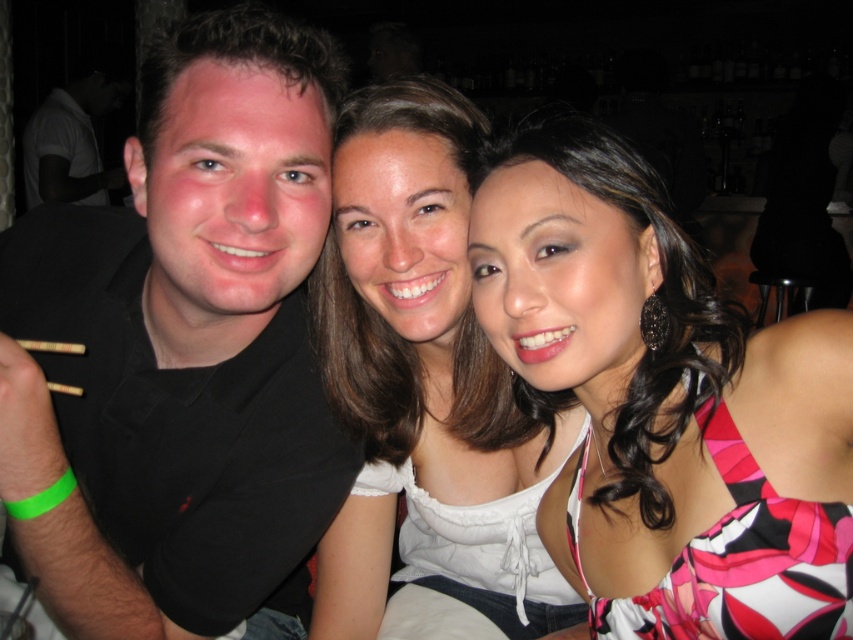
Question: Does black shirt at left appear on the left side of white satin blouse at center?

Choices:
 (A) no
 (B) yes

Answer: (B)

Question: Which of the following is the closest to the observer?

Choices:
 (A) (844, 492)
 (B) (213, 86)
 (C) (426, 272)

Answer: (A)

Question: Which point appears farthest from the camera in this image?

Choices:
 (A) (141, 280)
 (B) (71, 189)
 (C) (471, 218)

Answer: (B)

Question: Which point is farther to the camera?

Choices:
 (A) printed fabric dress at center
 (B) white satin blouse at center
 (C) white matte shirt at left
 (D) black shirt at left

Answer: (C)

Question: Is printed fabric dress at center smaller than white matte shirt at left?

Choices:
 (A) no
 (B) yes

Answer: (B)

Question: Does white satin blouse at center come behind white matte shirt at left?

Choices:
 (A) no
 (B) yes

Answer: (A)